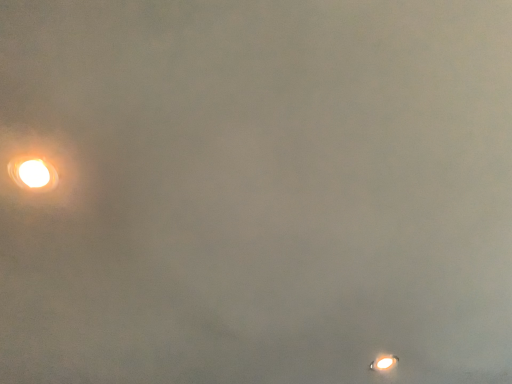
Where is `matte white street light at bottom right`? matte white street light at bottom right is located at coordinates pos(384,363).

Describe the element at coordinates (384, 363) in the screenshot. I see `matte white street light at bottom right` at that location.

Locate an element on the screen. Image resolution: width=512 pixels, height=384 pixels. matte white street light at bottom right is located at coordinates [384, 363].